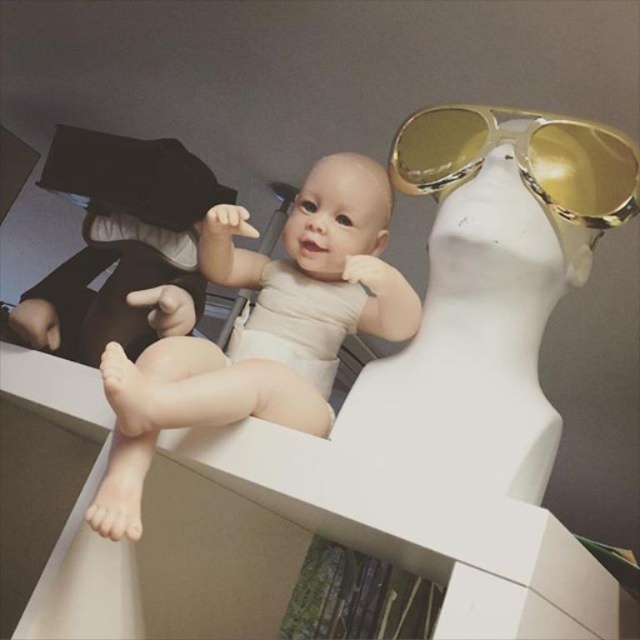
You are a photographer standing in front of the smooth beige baby at center. You want to take a closeup photo of the baby. The camera requires the subject to be at least 18 inches away to focus properly. Is the current distance sufficient?

The smooth beige baby at center and viewer are 19.12 inches apart from each other. Since the camera requires the subject to be at least 18 inches away, the current distance of 19.12 inches is sufficient for proper focus.

You are a photographer setting up a shoot. You have a smooth beige baby at center and gold reflective sunglasses at upper right in your frame. The baby is positioned on a white mannequin head. You need to adjust the lighting to avoid glare from the sunglasses. Since the baby is taller than the sunglasses, where should you position the light source relative to the baby to minimize glare on the sunglasses?

Since the smooth beige baby at center is taller than the gold reflective sunglasses at upper right, positioning the light source above and slightly behind the baby would help minimize glare on the sunglasses. This placement ensures the baby blocks some of the light from directly hitting the reflective lenses.

You are a photographer setting up a shoot. You have a smooth beige baby at center and gold reflective sunglasses at upper right in your frame. Based on their sizes, which object would you need to adjust the lighting for to avoid overexposure?

The gold reflective sunglasses at upper right would require adjusted lighting because they are smaller than the smooth beige baby at center and may reflect more light intensely due to their reflective surface.